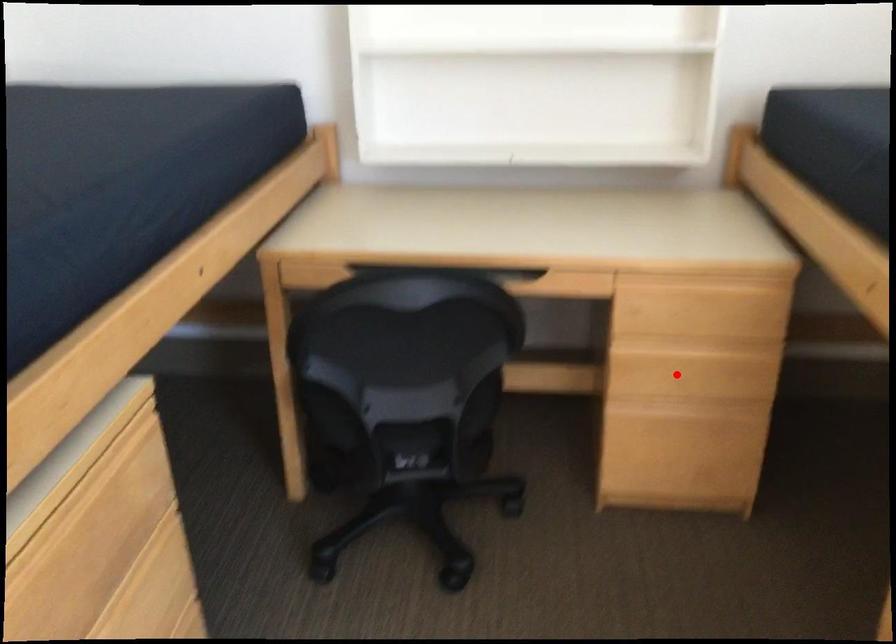
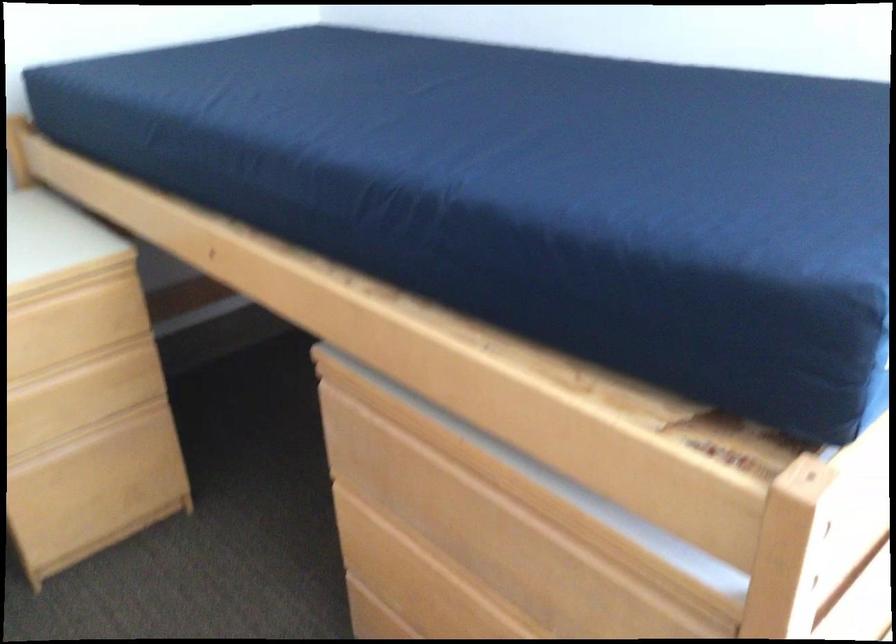
Locate, in the second image, the point that corresponds to the highlighted location in the first image.

(65, 410)